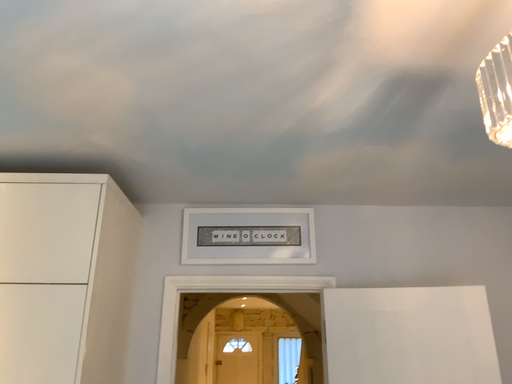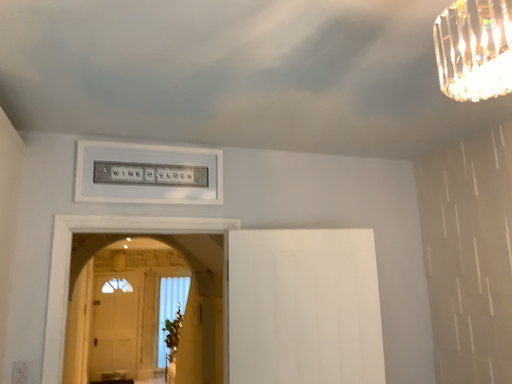
Question: How did the camera likely rotate when shooting the video?

Choices:
 (A) rotated right
 (B) rotated left

Answer: (A)